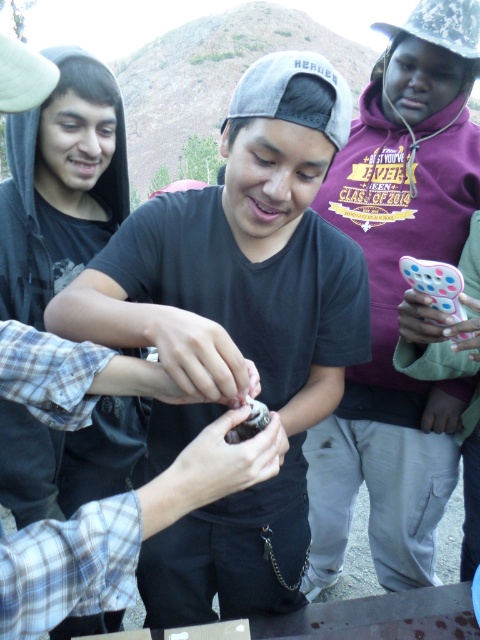
Based on the scene description, where is the black matte shirt at center located in terms of coordinates?

The black matte shirt at center is located at coordinates point (240,323).

You are a photographer trying to capture a candid shot of the group. You notice the black matte shirt at center and the spongy white bread at center. Which object should you focus on if you want to include both in your frame without moving the camera?

You should focus on the black matte shirt at center because it is positioned on the left side of the spongy white bread at center, so keeping the focus on the black matte shirt at center will allow both objects to be in the frame.